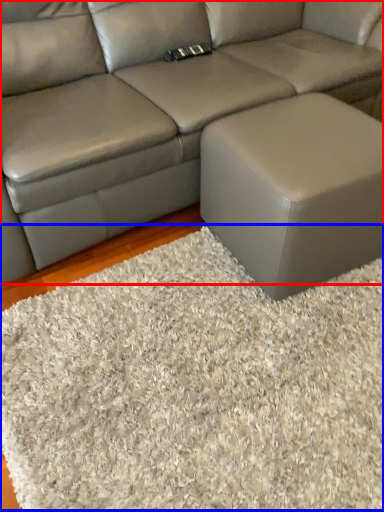
Question: Which object is closer to the camera taking this photo, studio couch (highlighted by a red box) or mat (highlighted by a blue box)?

Choices:
 (A) studio couch
 (B) mat

Answer: (B)